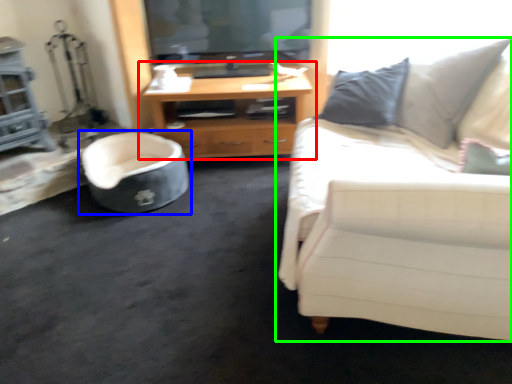
Question: Which object is positioned closest to cabinetry (highlighted by a red box)? Select from chair (highlighted by a blue box) and studio couch (highlighted by a green box).

Choices:
 (A) chair
 (B) studio couch

Answer: (A)